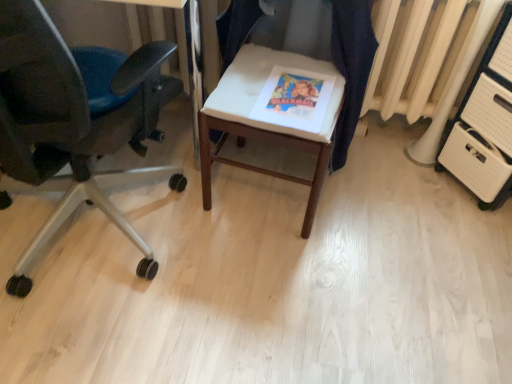
You are a GUI agent. You are given a task and a screenshot of the screen. Output one action in this format:
    pyautogui.click(x=<x>, y=<y>)
    Task: Click on the vacant region under white fabric chair at center (from a real-world perspective)
    
    Given the screenshot: What is the action you would take?
    pyautogui.click(x=268, y=197)